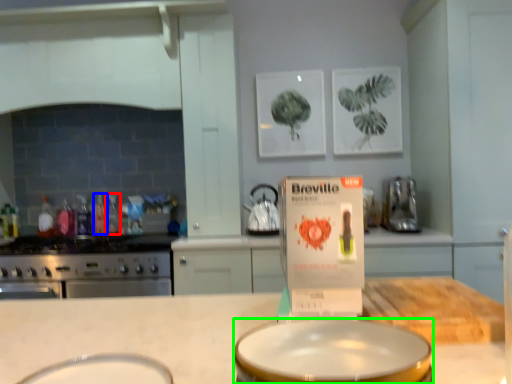
Question: Considering the real-world distances, which object is farthest from bottle (highlighted by a red box)? bottle (highlighted by a blue box) or basin (highlighted by a green box)?

Choices:
 (A) bottle
 (B) basin

Answer: (B)